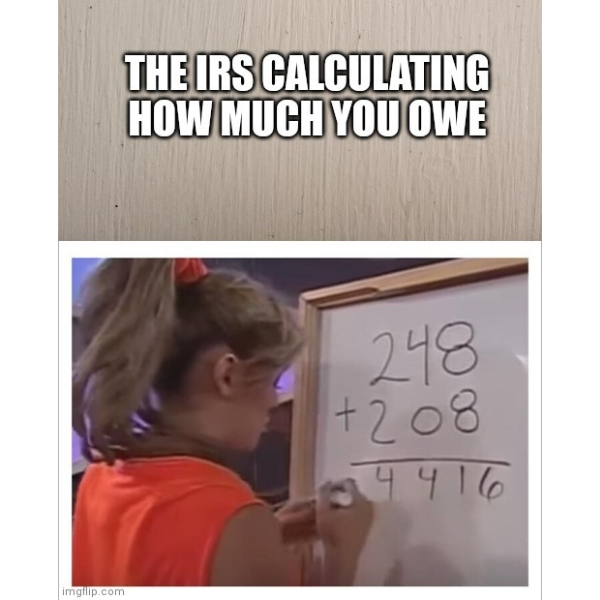
Find the location of a particular element. The width and height of the screenshot is (600, 600). whiteboard is located at coordinates (495, 377).